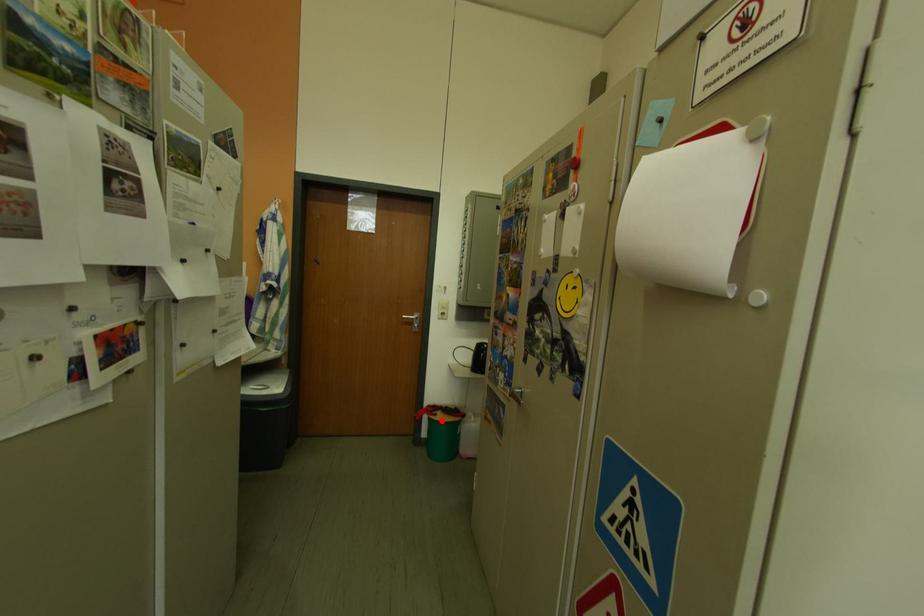
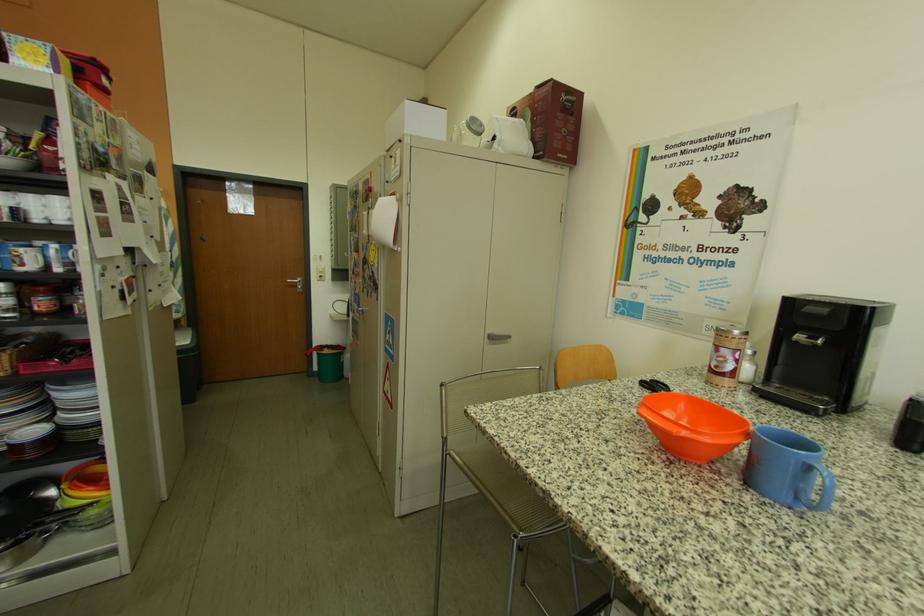
The point at the highlighted location is marked in the first image. Where is the corresponding point in the second image?

(331, 357)